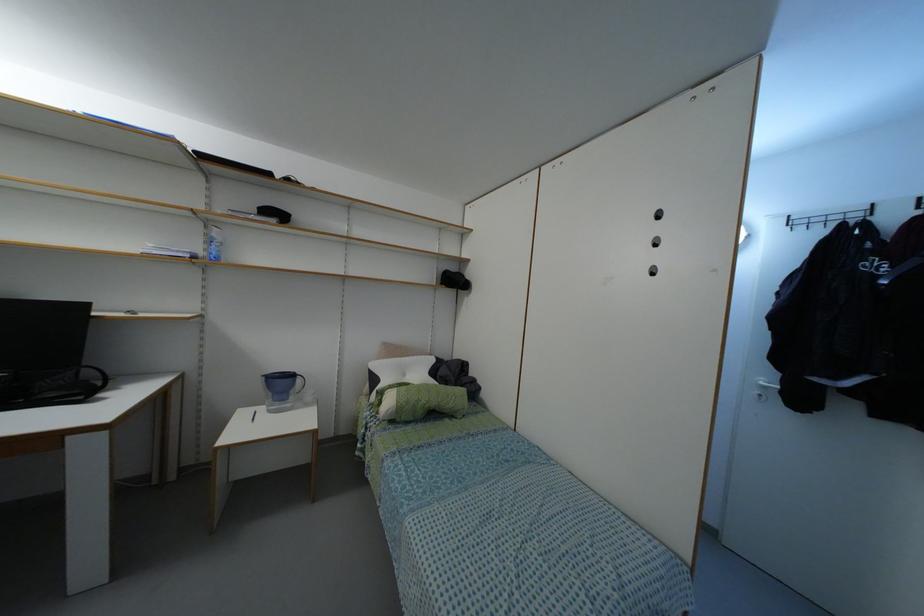
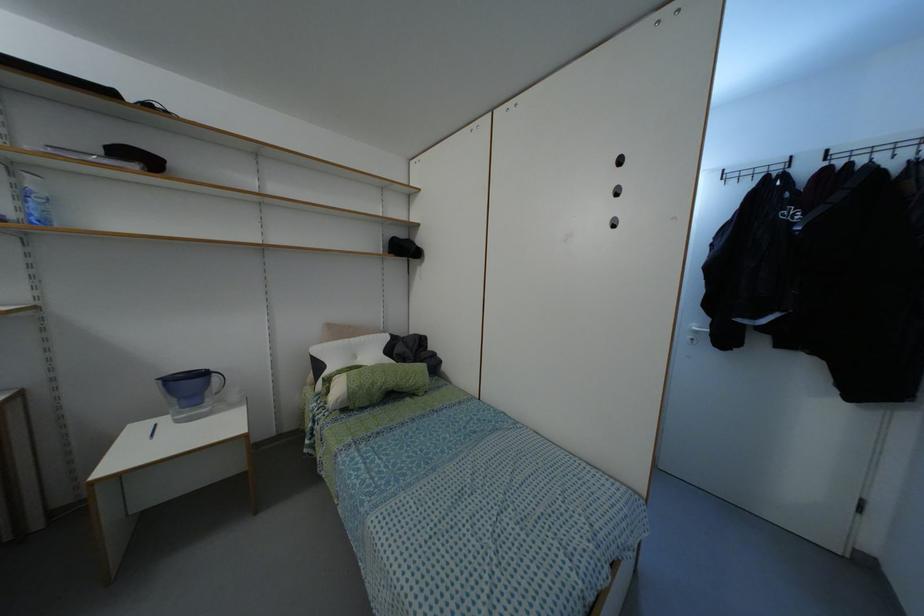
The point at (x=298, y=379) is marked in the first image. Where is the corresponding point in the second image?

(214, 378)